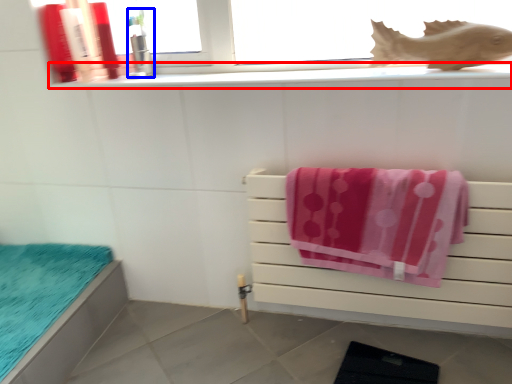
Question: Among these objects, which one is nearest to the camera, window sill (highlighted by a red box) or toiletry (highlighted by a blue box)?

Choices:
 (A) window sill
 (B) toiletry

Answer: (A)